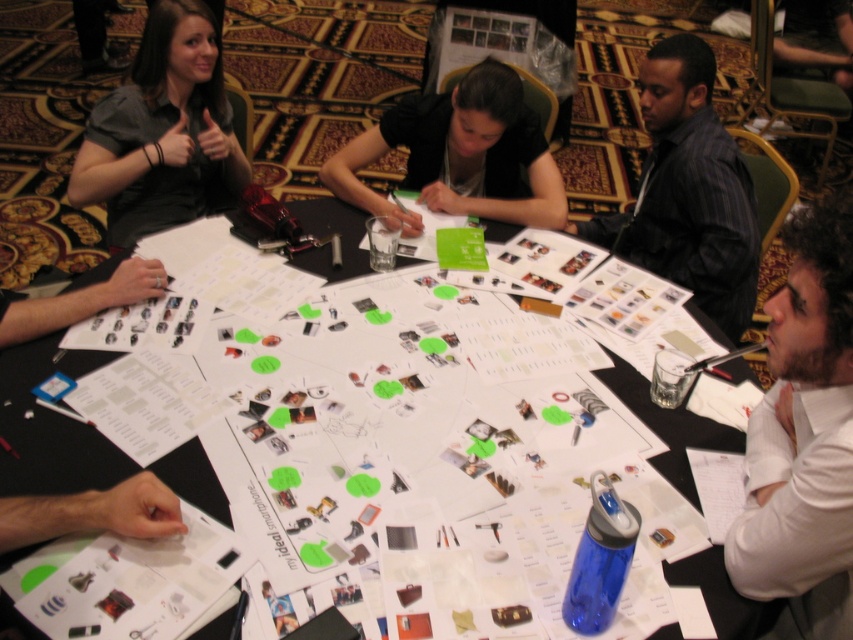
Question: Based on their relative distances, which object is nearer to the white shirt at lower right?

Choices:
 (A) matte black shirt at upper center
 (B) dark striped shirt at upper right
 (C) matte black shirt at upper left

Answer: (B)

Question: Is white paper at center to the left of matte black shirt at upper left from the viewer's perspective?

Choices:
 (A) no
 (B) yes

Answer: (A)

Question: Observing the image, what is the correct spatial positioning of white shirt at lower right in reference to matte black shirt at upper left?

Choices:
 (A) below
 (B) above

Answer: (A)

Question: Which point is farther to the camera?

Choices:
 (A) matte black shirt at upper center
 (B) white paper at center

Answer: (A)

Question: Among these points, which one is farthest from the camera?

Choices:
 (A) (833, 452)
 (B) (90, 272)
 (C) (363, 138)
 (D) (170, 61)

Answer: (C)

Question: Does white shirt at lower right lie in front of matte black shirt at upper left?

Choices:
 (A) no
 (B) yes

Answer: (B)